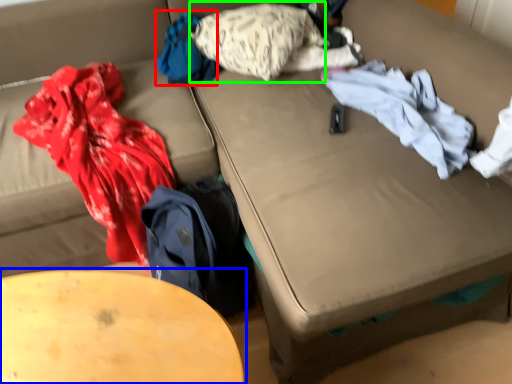
Question: Which object is the closest to the clothing (highlighted by a red box)? Choose among these: table (highlighted by a blue box) or pillow (highlighted by a green box).

Choices:
 (A) table
 (B) pillow

Answer: (B)